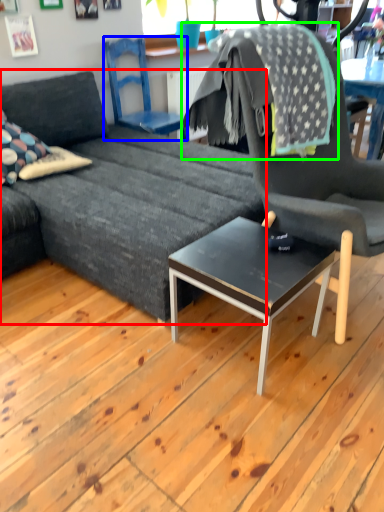
Question: Which object is the farthest from studio couch (highlighted by a red box)? Choose among these: chair (highlighted by a blue box) or blanket (highlighted by a green box).

Choices:
 (A) chair
 (B) blanket

Answer: (A)